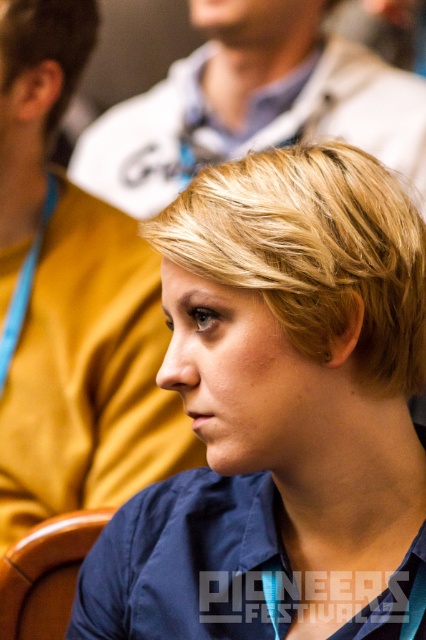
You are a photographer trying to capture a group photo. You notice two people with blonde hair in the scene. One has blondehair at center and the other has blonde hair at upper left. Which person with blonde hair would you need to position closer to the camera to ensure both appear the same size in the photo?

You should position the blonde hair at upper left closer to the camera because the blondehair at center might be wider than blonde hair at upper left, meaning it is already larger in the frame. Bringing the smaller one forward would help balance their sizes.